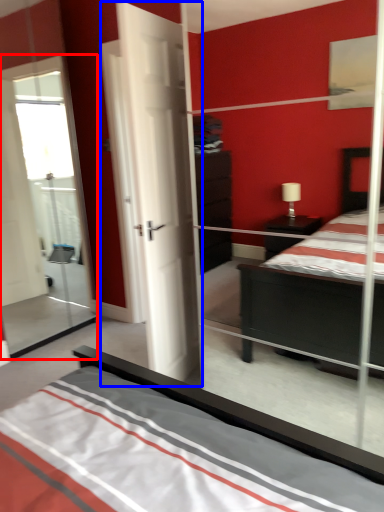
Question: Among these objects, which one is nearest to the camera, glass door (highlighted by a red box) or door (highlighted by a blue box)?

Choices:
 (A) glass door
 (B) door

Answer: (B)